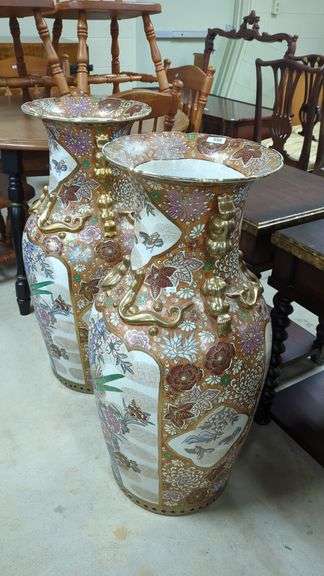
Find the location of a particular element. The image size is (324, 576). floor is located at coordinates (81, 515).